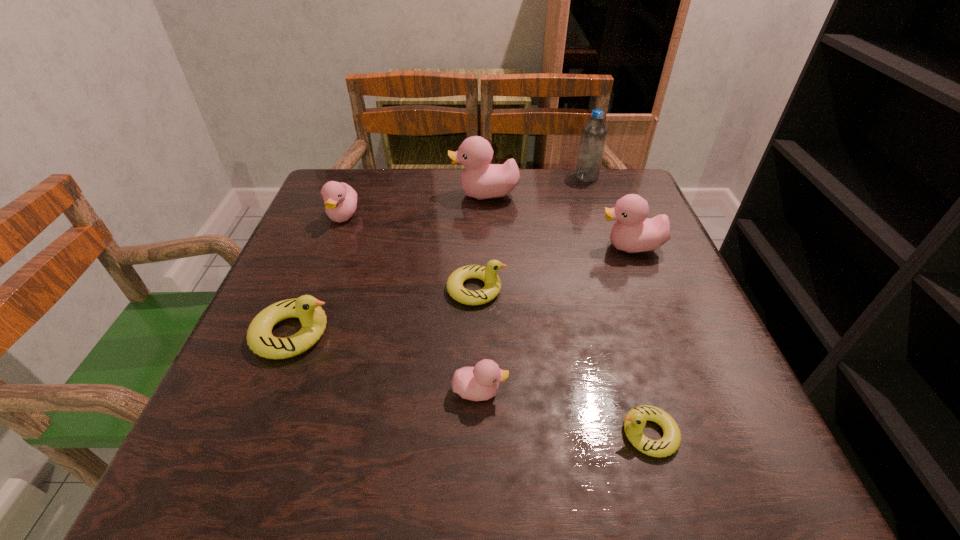
Where is `free point between the second nearest duckling and the third farthest duckling`? The width and height of the screenshot is (960, 540). free point between the second nearest duckling and the third farthest duckling is located at coordinates (555, 319).

You are a GUI agent. You are given a task and a screenshot of the screen. Output one action in this format:
    pyautogui.click(x=<x>, y=<y>)
    Task: Click on the vacant region between the blue water bottle and the second yellow duckling from right to left
    Image resolution: width=960 pixels, height=540 pixels.
    Given the screenshot: What is the action you would take?
    pyautogui.click(x=531, y=233)

I want to click on free space between the shortest duckling and the leftmost pink duckling, so click(x=496, y=325).

Find the location of a particular element. free point between the second tallest object and the leftmost yellow duckling is located at coordinates [389, 264].

This screenshot has height=540, width=960. What are the coordinates of `free space between the shortest object and the second tallest object` in the screenshot? It's located at (566, 314).

The width and height of the screenshot is (960, 540). Find the location of `vacant space that is in between the nearest yellow duckling and the seventh shortest object`. vacant space that is in between the nearest yellow duckling and the seventh shortest object is located at coordinates (566, 314).

Identify the location of vacant space that's between the biggest yellow duckling and the smallest pink duckling. (386, 362).

Image resolution: width=960 pixels, height=540 pixels. Find the location of `vacant area that lies between the blue water bottle and the smallest yellow duckling`. vacant area that lies between the blue water bottle and the smallest yellow duckling is located at coordinates (617, 305).

At what (x,y) coordinates should I click in order to perform the action: click on free space between the second yellow duckling from left to right and the tallest duckling. Please return your answer as a coordinate pair (x, y). Looking at the image, I should click on (480, 242).

The image size is (960, 540). Find the location of `unoccupied area between the water bottle and the nearest yellow duckling`. unoccupied area between the water bottle and the nearest yellow duckling is located at coordinates (617, 305).